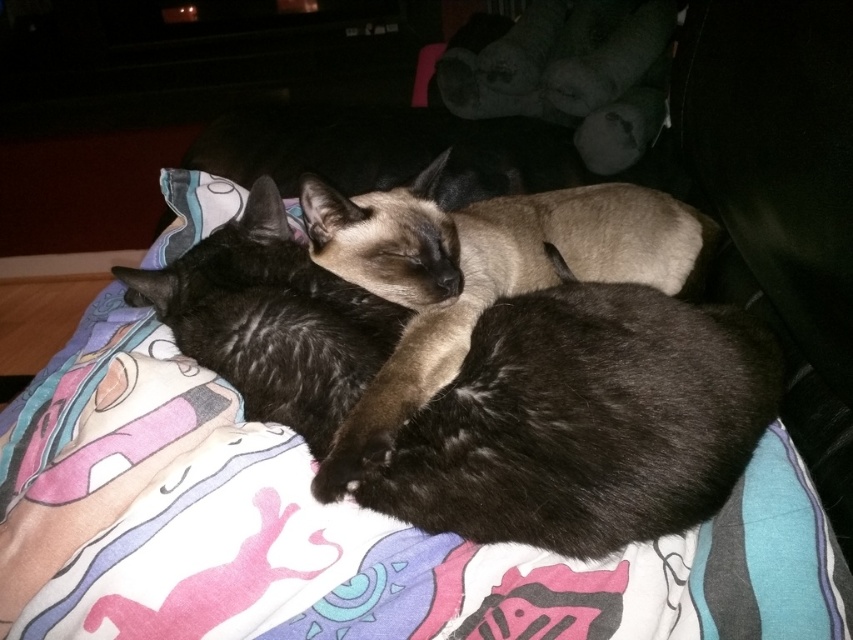
Question: Is printed fabric blanket at center above smokey brown fur at center?

Choices:
 (A) yes
 (B) no

Answer: (B)

Question: Can you confirm if printed fabric blanket at center is positioned to the left of smokey brown fur at center?

Choices:
 (A) no
 (B) yes

Answer: (B)

Question: Which object is farther from the camera taking this photo?

Choices:
 (A) smokey brown fur at center
 (B) printed fabric blanket at center

Answer: (A)

Question: Considering the relative positions of printed fabric blanket at center and smokey brown fur at center in the image provided, where is printed fabric blanket at center located with respect to smokey brown fur at center?

Choices:
 (A) left
 (B) right

Answer: (A)